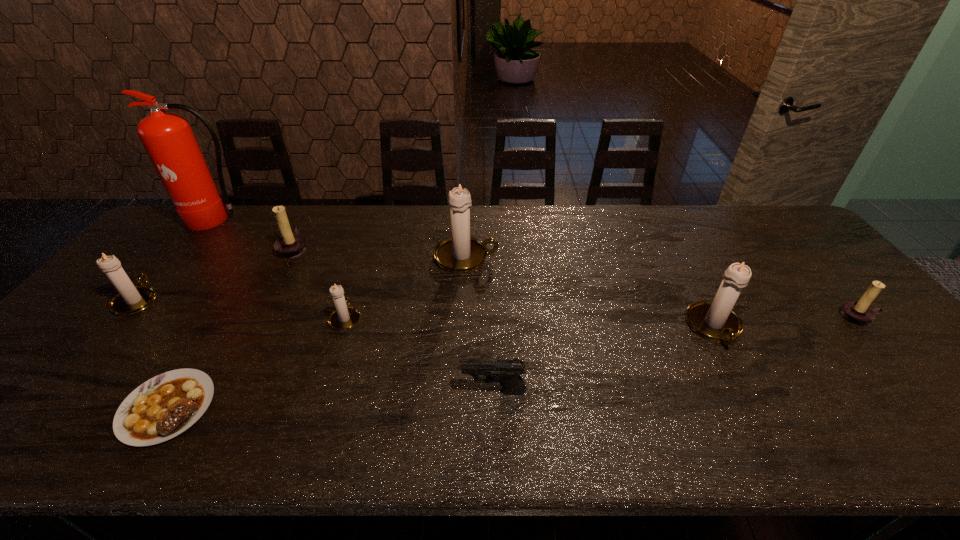
At what (x,y) coordinates should I click in order to perform the action: click on free location located 0.200m on the wick of the bigger brown candle holder. Please return your answer as a coordinate pair (x, y). The width and height of the screenshot is (960, 540). Looking at the image, I should click on (373, 248).

This screenshot has width=960, height=540. What are the coordinates of `free region located 0.370m on the handle side of the leftmost white candle holder` in the screenshot? It's located at (210, 213).

Locate an element on the screen. free location located 0.150m on the handle side of the leftmost white candle holder is located at coordinates (178, 252).

The width and height of the screenshot is (960, 540). What are the coordinates of `blank space located 0.250m on the handle side of the leftmost white candle holder` in the screenshot? It's located at (193, 233).

This screenshot has width=960, height=540. What are the coordinates of `free region located 0.130m on the handle side of the fourth candle holder from right to left` in the screenshot? It's located at (359, 274).

Find the location of a particular element. This screenshot has width=960, height=540. vacant space located on the handle side of the fourth candle holder from right to left is located at coordinates (364, 259).

In order to click on blank space located 0.290m on the handle side of the fourth candle holder from right to left in this screenshot , I will do `click(370, 241)`.

Where is `free space located 0.210m on the wick of the rightmost candle holder`? The width and height of the screenshot is (960, 540). free space located 0.210m on the wick of the rightmost candle holder is located at coordinates (929, 397).

I want to click on vacant region located 0.390m at the barrel of the second shortest object, so click(x=289, y=391).

The width and height of the screenshot is (960, 540). Identify the location of vacant space situated at the barrel of the second shortest object. (431, 391).